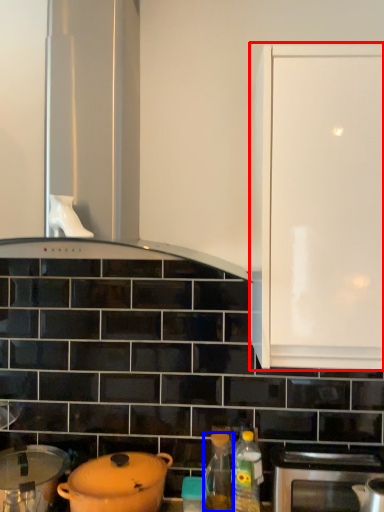
Question: Which point is further to the camera, cabinetry (highlighted by a red box) or bottle (highlighted by a blue box)?

Choices:
 (A) cabinetry
 (B) bottle

Answer: (B)